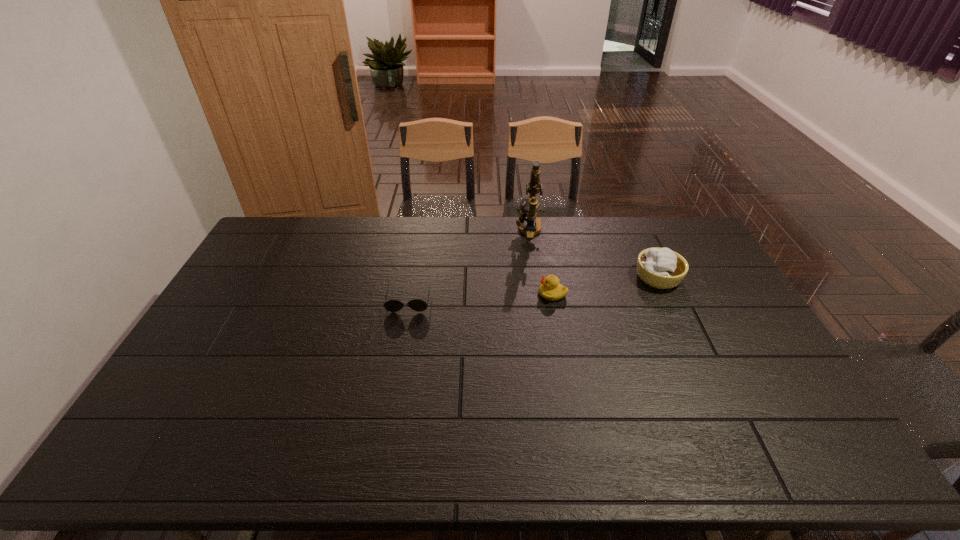
In the image, there is a desktop. At what (x,y) coordinates should I click in order to perform the action: click on vacant space at the near left corner. Please return your answer as a coordinate pair (x, y). Looking at the image, I should click on (152, 441).

The image size is (960, 540). I want to click on vacant space at the far right corner of the desktop, so click(674, 240).

Where is `vacant area that lies between the third shortest object and the sunglasses`? This screenshot has width=960, height=540. vacant area that lies between the third shortest object and the sunglasses is located at coordinates (534, 289).

Locate an element on the screen. The image size is (960, 540). free space that is in between the rightmost object and the shortest object is located at coordinates (534, 289).

Image resolution: width=960 pixels, height=540 pixels. In order to click on vacant space that's between the microscope and the leftmost object in this screenshot , I will do `click(468, 266)`.

At what (x,y) coordinates should I click in order to perform the action: click on free space between the rightmost object and the microscope. Please return your answer as a coordinate pair (x, y). This screenshot has width=960, height=540. Looking at the image, I should click on (593, 254).

Identify the location of free point between the microscope and the rightmost object. (593, 254).

What are the coordinates of `free space between the second shortest object and the microscope` in the screenshot? It's located at (540, 262).

Find the location of a particular element. Image resolution: width=960 pixels, height=540 pixels. free area in between the leftmost object and the whipped cream is located at coordinates (534, 289).

This screenshot has width=960, height=540. What are the coordinates of `vacant area that lies between the third tallest object and the whipped cream` in the screenshot? It's located at (605, 285).